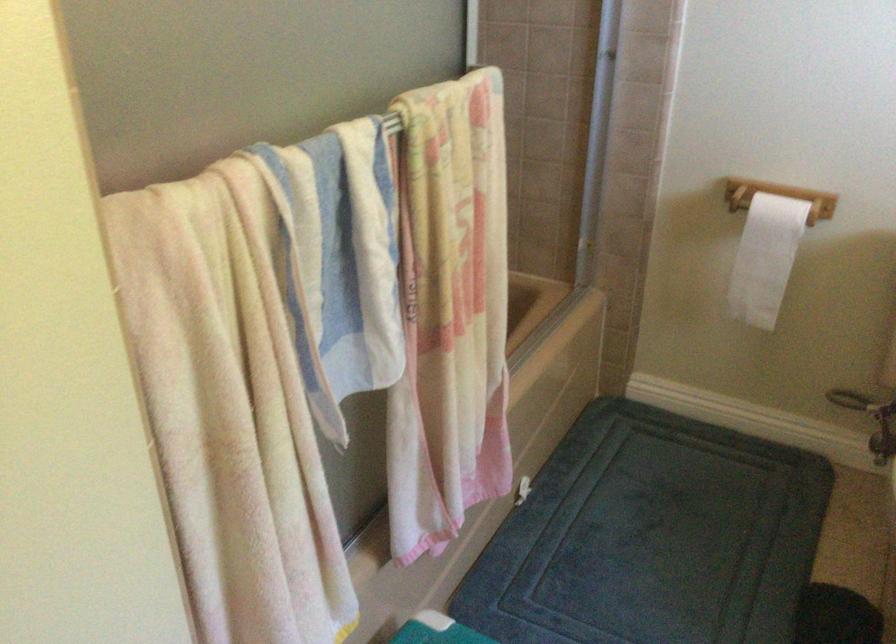
Where is `white toilet paper`? This screenshot has height=644, width=896. white toilet paper is located at coordinates (764, 258).